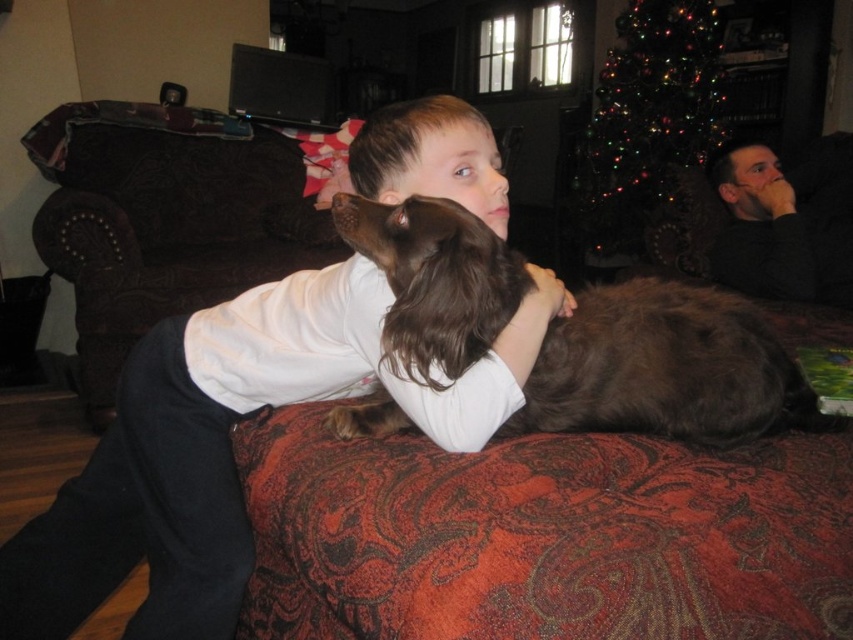
Does brown furry dog at center lie in front of brown fur at center?

Yes, it is in front of brown fur at center.

What do you see at coordinates (666, 369) in the screenshot? I see `brown furry dog at center` at bounding box center [666, 369].

Locate an element on the screen. brown furry dog at center is located at coordinates (666, 369).

Between white soft shirt at center and brown fur at center, which one appears on the right side from the viewer's perspective?

white soft shirt at center

Is white soft shirt at center in front of brown fur at center?

Yes, white soft shirt at center is closer to the viewer.

Is point (260, 291) farther from viewer compared to point (160, 241)?

No, (260, 291) is closer to viewer.

Where is `white soft shirt at center`? white soft shirt at center is located at coordinates (230, 445).

Describe the element at coordinates (230, 445) in the screenshot. I see `white soft shirt at center` at that location.

Who is positioned more to the left, white soft shirt at center or brown furry dog at center?

Positioned to the left is white soft shirt at center.

What do you see at coordinates (230, 445) in the screenshot? I see `white soft shirt at center` at bounding box center [230, 445].

The width and height of the screenshot is (853, 640). I want to click on white soft shirt at center, so click(230, 445).